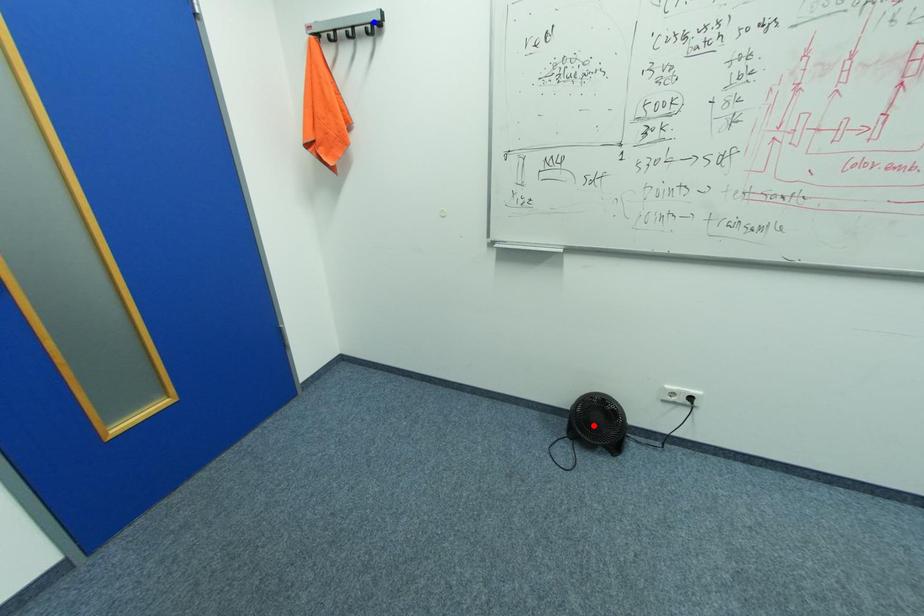
Question: Which of the two points in the image is closer to the camera?

Choices:
 (A) Blue point is closer.
 (B) Red point is closer.

Answer: (A)